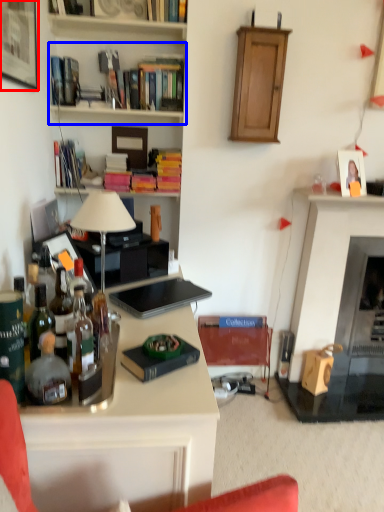
Question: Which object is closer to the camera taking this photo, picture frame (highlighted by a red box) or shelf (highlighted by a blue box)?

Choices:
 (A) picture frame
 (B) shelf

Answer: (A)